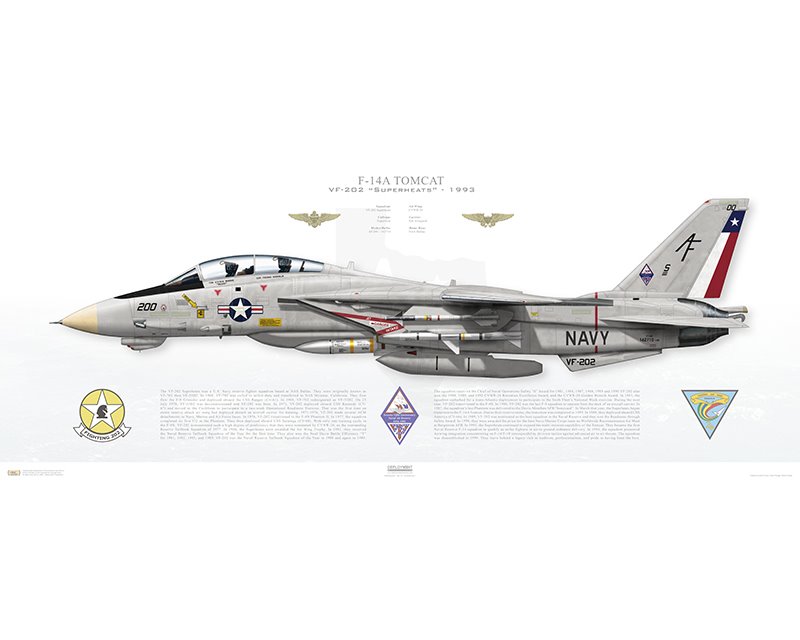
The width and height of the screenshot is (800, 640). I want to click on decoration, so click(x=321, y=218), click(x=492, y=223), click(x=98, y=406), click(x=389, y=413), click(x=702, y=409).